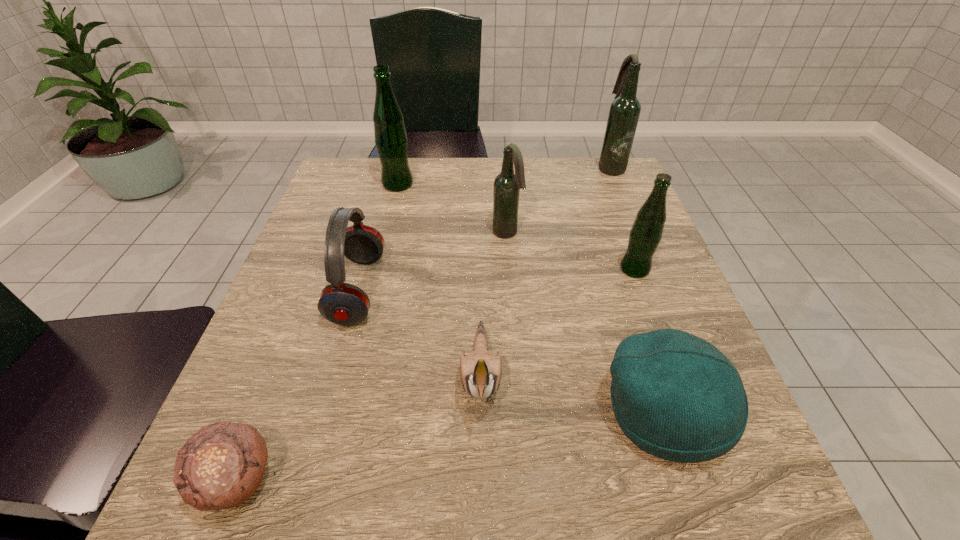
Find the location of a particular element. Image resolution: width=960 pixels, height=540 pixels. vacant area at the far edge of the desktop is located at coordinates (x=430, y=202).

The height and width of the screenshot is (540, 960). What are the coordinates of `blank area at the near edge` in the screenshot? It's located at (528, 461).

Image resolution: width=960 pixels, height=540 pixels. In the image, there is a desktop. Identify the location of free space at the left edge. (314, 375).

Where is `free region at the right edge of the desktop`? The image size is (960, 540). free region at the right edge of the desktop is located at coordinates (674, 282).

I want to click on free region at the near right corner of the desktop, so click(x=734, y=514).

Where is `unoccupied position between the second nearest beer bottle and the bigger green beer bottle`? This screenshot has width=960, height=540. unoccupied position between the second nearest beer bottle and the bigger green beer bottle is located at coordinates (452, 208).

The image size is (960, 540). Find the location of `empty space between the bird and the right green beer bottle`. empty space between the bird and the right green beer bottle is located at coordinates (558, 323).

I want to click on empty space between the nearer dark beer bottle and the shortest object, so click(372, 357).

The width and height of the screenshot is (960, 540). What are the coordinates of `free spot between the smaller green beer bottle and the nearer dark beer bottle` in the screenshot? It's located at (570, 251).

In order to click on unoccupied area between the muffin and the beanie in this screenshot , I will do `click(451, 446)`.